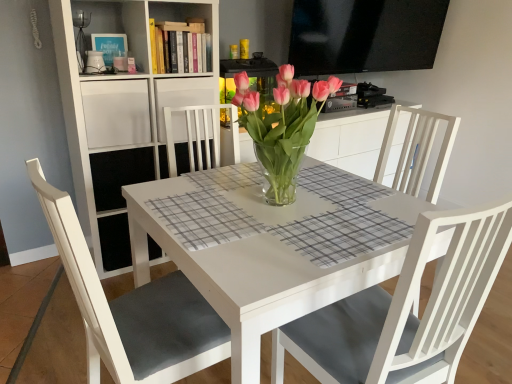
Question: Is white matte chair at lower left located outside pink glass vase at center?

Choices:
 (A) yes
 (B) no

Answer: (A)

Question: From the image's perspective, is white matte chair at lower left located above pink glass vase at center?

Choices:
 (A) no
 (B) yes

Answer: (A)

Question: From a real-world perspective, is white matte chair at lower left on top of pink glass vase at center?

Choices:
 (A) no
 (B) yes

Answer: (A)

Question: Considering the relative sizes of white matte chair at lower left and pink glass vase at center in the image provided, is white matte chair at lower left shorter than pink glass vase at center?

Choices:
 (A) no
 (B) yes

Answer: (A)

Question: Considering the relative sizes of white matte chair at lower left and pink glass vase at center in the image provided, is white matte chair at lower left bigger than pink glass vase at center?

Choices:
 (A) yes
 (B) no

Answer: (A)

Question: From a real-world perspective, is white matte chair at lower left under pink glass vase at center?

Choices:
 (A) no
 (B) yes

Answer: (B)

Question: From a real-world perspective, is white matte chair at lower left below white glossy table at center?

Choices:
 (A) yes
 (B) no

Answer: (B)

Question: Does white matte chair at lower left come behind white glossy table at center?

Choices:
 (A) yes
 (B) no

Answer: (B)

Question: Can you confirm if white matte chair at lower left is shorter than white glossy table at center?

Choices:
 (A) yes
 (B) no

Answer: (B)

Question: From the image's perspective, is white matte chair at lower left below white glossy table at center?

Choices:
 (A) no
 (B) yes

Answer: (A)

Question: Does white matte chair at lower left appear on the right side of white glossy table at center?

Choices:
 (A) no
 (B) yes

Answer: (A)

Question: Is white matte chair at lower left not inside white glossy table at center?

Choices:
 (A) yes
 (B) no

Answer: (A)

Question: Considering the relative sizes of white wood shelf at upper center, the 3th shelf positioned from the bottom, and white glossy table at center in the image provided, is white wood shelf at upper center, the 3th shelf positioned from the bottom, taller than white glossy table at center?

Choices:
 (A) no
 (B) yes

Answer: (A)